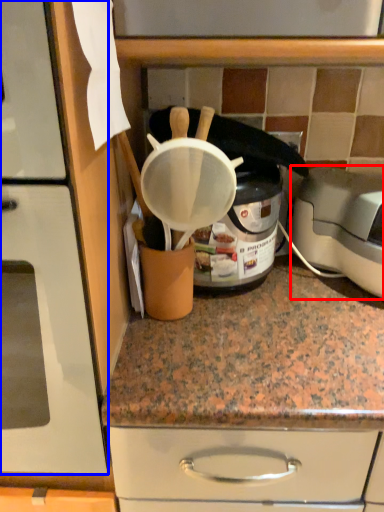
Question: Among these objects, which one is nearest to the camera, toaster (highlighted by a red box) or home appliance (highlighted by a blue box)?

Choices:
 (A) toaster
 (B) home appliance

Answer: (B)